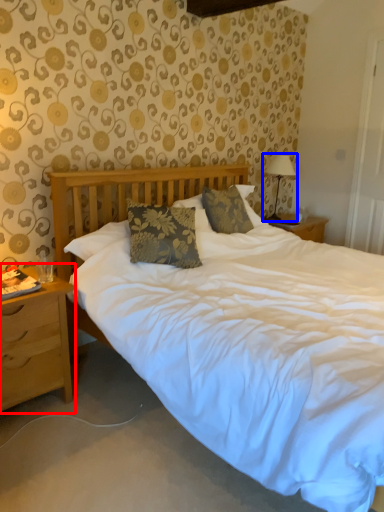
Question: Which point is closer to the camera, nightstand (highlighted by a red box) or table lamp (highlighted by a blue box)?

Choices:
 (A) nightstand
 (B) table lamp

Answer: (A)